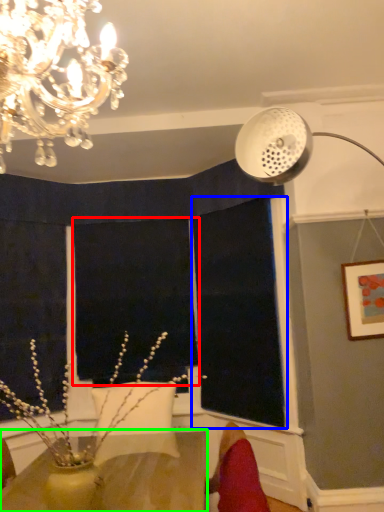
Question: Estimate the real-world distances between objects in this image. Which object is farther from window screen (highlighted by a red box), window screen (highlighted by a blue box) or table (highlighted by a green box)?

Choices:
 (A) window screen
 (B) table

Answer: (B)